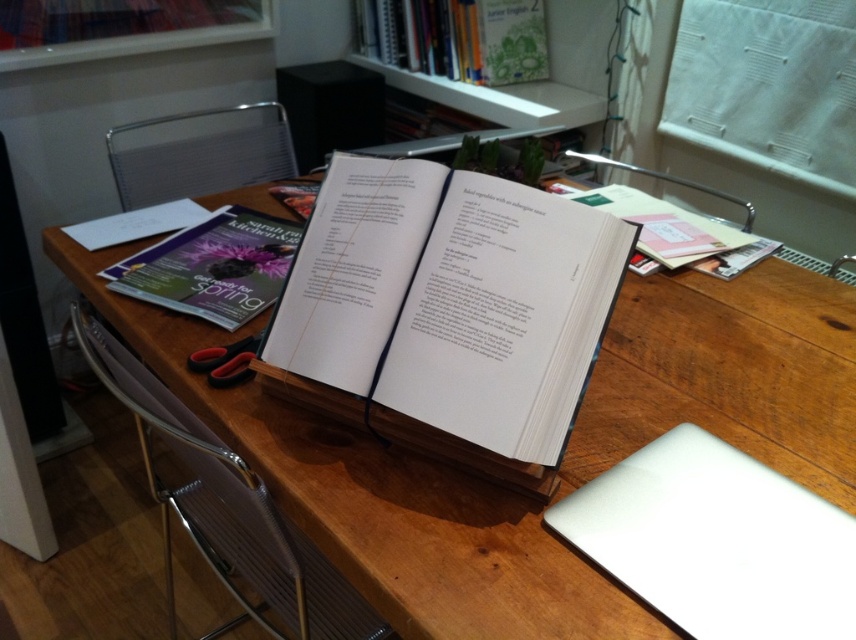
You are standing in the workspace shown in the image. You need to place a new item exactly at the coordinates point (381, 499). Where should you place it?

The coordinates point (381, 499) correspond to the wooden table at center, so you should place the item there.

You are standing in front of the desk and want to pick up an object. If you first reach for the object at point (473, 506) and then the one at point (292, 541), which point will require you to stretch your hand further away from your body?

The point at (292, 541) will require stretching further because it is farther from the camera compared to point (473, 506).